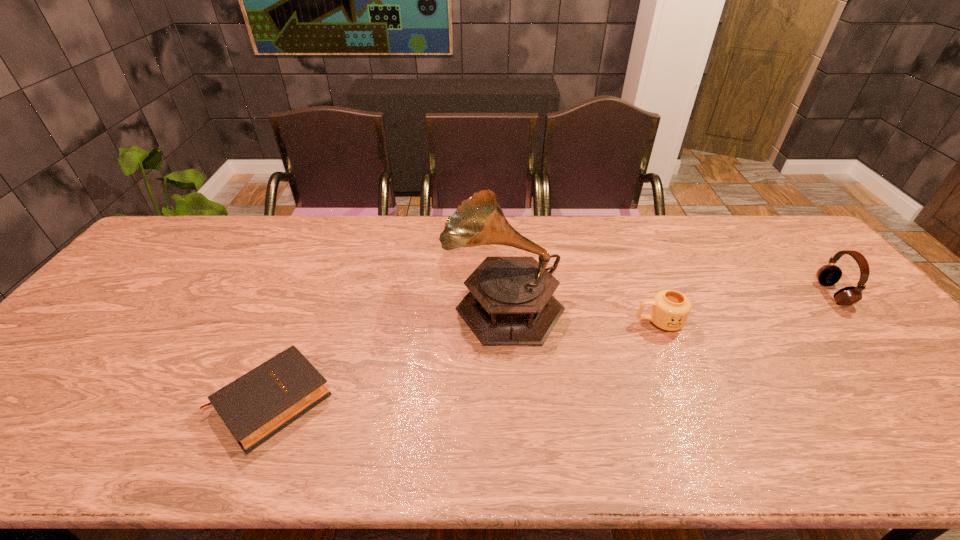
You are a GUI agent. You are given a task and a screenshot of the screen. Output one action in this format:
    pyautogui.click(x=<x>, y=<y>)
    Task: Click on the free space between the second object from right to left and the headset
    This screenshot has width=960, height=540.
    Given the screenshot: What is the action you would take?
    pyautogui.click(x=746, y=308)

This screenshot has width=960, height=540. Find the location of `empty space between the tallest object and the third object from left to right`. empty space between the tallest object and the third object from left to right is located at coordinates (581, 313).

Image resolution: width=960 pixels, height=540 pixels. I want to click on free spot between the shortest object and the headset, so click(x=552, y=347).

You are a GUI agent. You are given a task and a screenshot of the screen. Output one action in this format:
    pyautogui.click(x=<x>, y=<y>)
    Task: Click on the object identified as the closest to the nearest object
    This screenshot has height=540, width=960.
    Given the screenshot: What is the action you would take?
    pyautogui.click(x=511, y=302)

Identify which object is the nearest to the rightmost object. Please provide its 2D coordinates. Your answer should be formatted as a tuple, i.e. [(x, y)], where the tuple contains the x and y coordinates of a point satisfying the conditions above.

[(669, 310)]